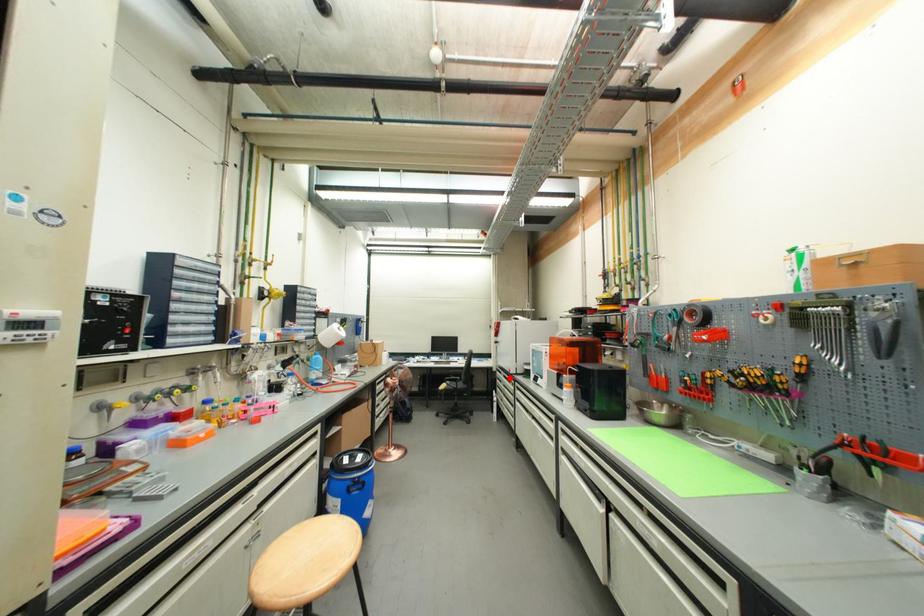
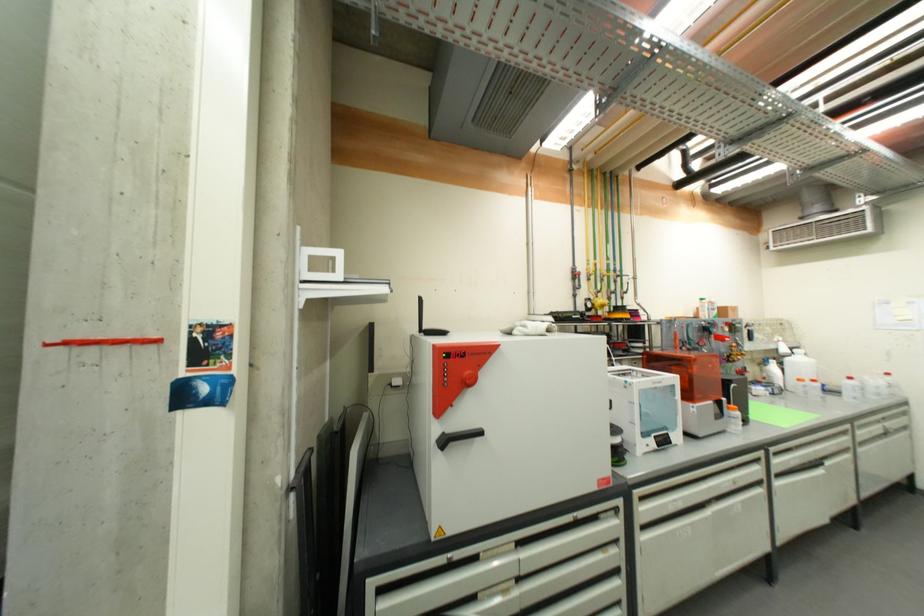
Question: I am providing you with two images of the same scene from different viewpoints. A red point is shown in image1. For the corresponding object point in image2, is it positioned nearer or farther from the camera?

Choices:
 (A) Nearer
 (B) Farther

Answer: (A)